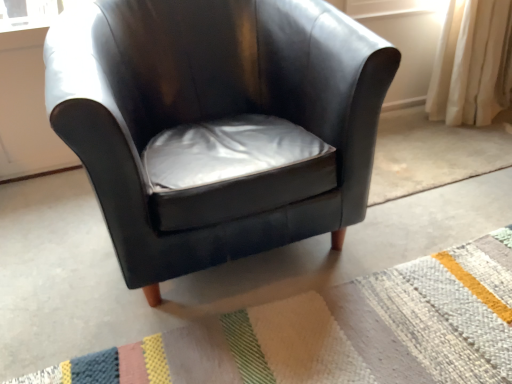
Question: From a real-world perspective, relative to textured woolen mat at lower right, is matte black armchair at center vertically above or below?

Choices:
 (A) below
 (B) above

Answer: (B)

Question: Is matte black armchair at center inside or outside of textured woolen mat at lower right?

Choices:
 (A) outside
 (B) inside

Answer: (A)

Question: In the image, is matte black armchair at center on the left side or the right side of textured woolen mat at lower right?

Choices:
 (A) right
 (B) left

Answer: (B)

Question: Is textured woolen mat at lower right spatially inside matte black armchair at center, or outside of it?

Choices:
 (A) outside
 (B) inside

Answer: (A)

Question: From a real-world perspective, is textured woolen mat at lower right above or below matte black armchair at center?

Choices:
 (A) above
 (B) below

Answer: (B)

Question: Is textured woolen mat at lower right taller or shorter than matte black armchair at center?

Choices:
 (A) tall
 (B) short

Answer: (B)

Question: In terms of size, does textured woolen mat at lower right appear bigger or smaller than matte black armchair at center?

Choices:
 (A) big
 (B) small

Answer: (B)